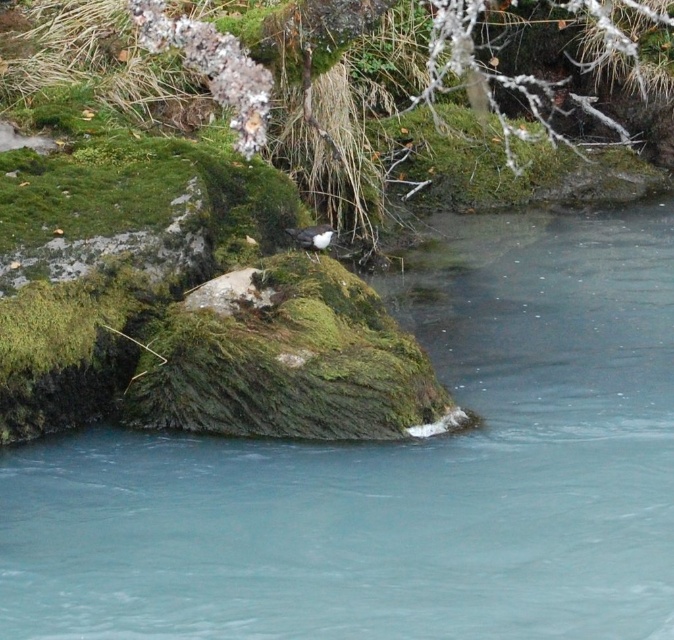
Is clear blue water at center wider than green mossy rock at center?

Yes.

Which is more to the right, clear blue water at center or green mossy rock at center?

From the viewer's perspective, green mossy rock at center appears more on the right side.

What do you see at coordinates (398, 472) in the screenshot? I see `clear blue water at center` at bounding box center [398, 472].

Where is `clear blue water at center`? This screenshot has height=640, width=674. clear blue water at center is located at coordinates (398, 472).